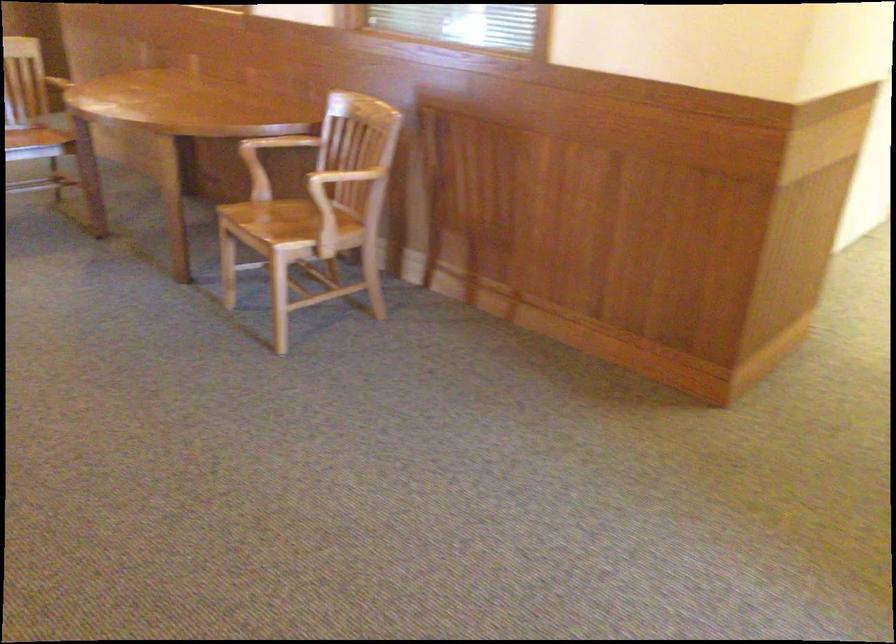
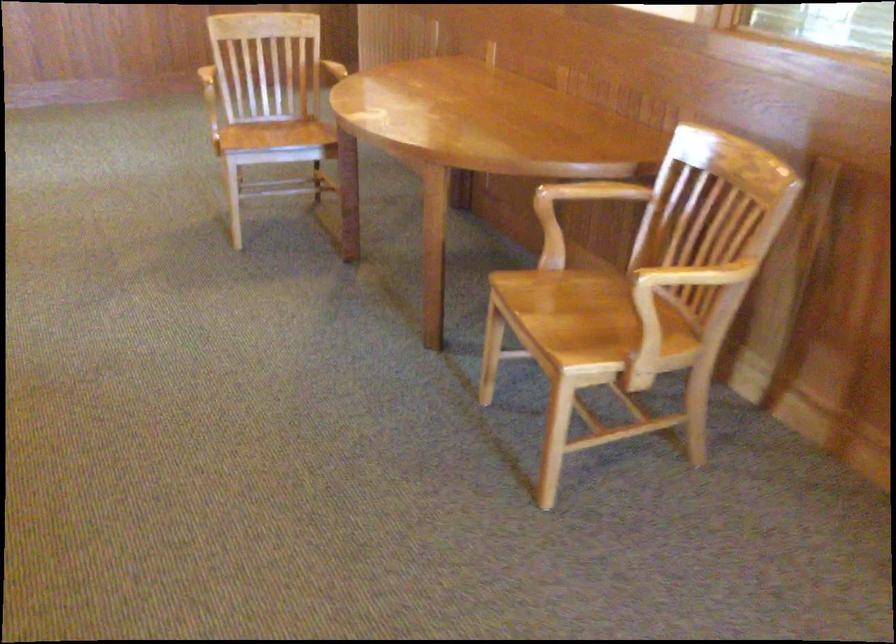
In the second image, find the point that corresponds to [341,172] in the first image.

(696, 275)